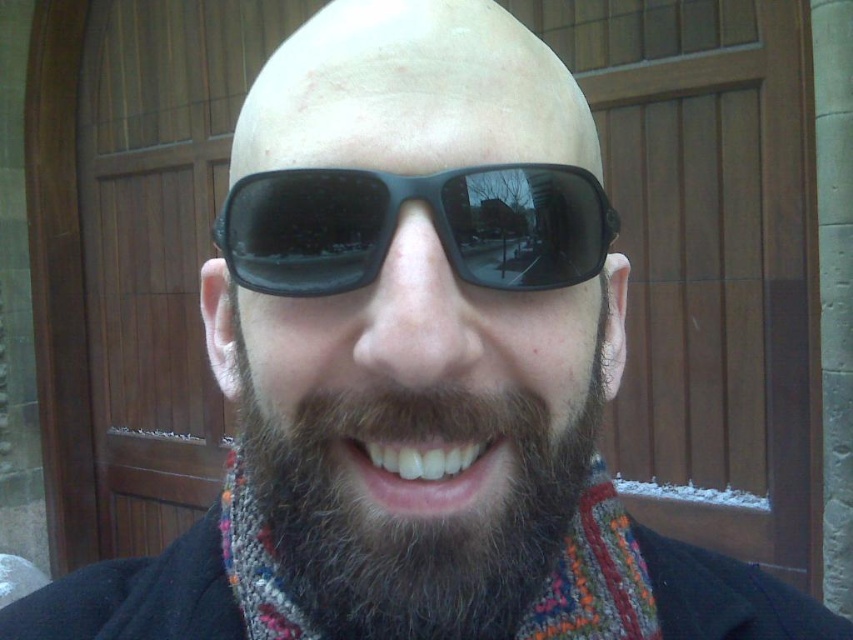
You are a photographer trying to capture the perfect shot of the dark brown fuzzy beard at center and the black plastic sunglasses at center. Based on their sizes, which object should you focus on first if you want both to be in clear focus?

The dark brown fuzzy beard at center has a larger size compared to the black plastic sunglasses at center, so you should focus on the dark brown fuzzy beard at center first to ensure both are in clear focus.

You are a photographer trying to capture the reflection in the black plastic sunglasses at center. To ensure the reflection includes the dark brown fuzzy beard at center, where should you position the light source relative to the sunglasses?

A: The dark brown fuzzy beard at center is below the black plastic sunglasses at center. To capture its reflection in the sunglasses, position the light source above the sunglasses so that the reflection of the beard appears in the lower part of the lenses.

You are a photographer adjusting the focus on your camera. You want to capture both the dark brown fuzzy beard at center and the black plastic sunglasses at center in sharp detail. Given that your camera can only focus on objects within a 2.5 inch range, will both objects be in focus?

The distance between the dark brown fuzzy beard at center and the black plastic sunglasses at center is 2.72 inches, which exceeds the camera focus range of 2.5 inches. Therefore, both objects cannot be in focus simultaneously.